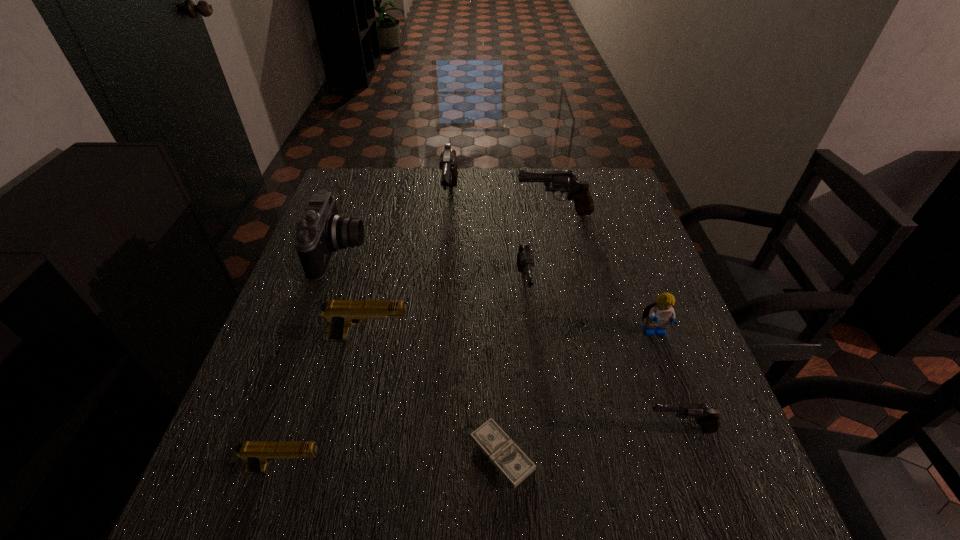
Locate an element on the screen. the smallest gray pistol is located at coordinates (708, 417).

Image resolution: width=960 pixels, height=540 pixels. I want to click on the smaller tan pistol, so click(256, 454).

I want to click on the nearest pistol, so click(x=256, y=454).

Locate an element on the screen. Image resolution: width=960 pixels, height=540 pixels. money is located at coordinates (506, 456).

You are a GUI agent. You are given a task and a screenshot of the screen. Output one action in this format:
    pyautogui.click(x=<x>, y=<y>)
    Task: Click on the vacant region located at the barrel of the leftmost gray pistol
    
    Given the screenshot: What is the action you would take?
    pos(438,337)

Where is `vacant space located 0.400m on the front-facing side of the black camera`? The height and width of the screenshot is (540, 960). vacant space located 0.400m on the front-facing side of the black camera is located at coordinates (516, 252).

At what (x,y) coordinates should I click in order to perform the action: click on vacant space located at the barrel of the fifth shortest pistol. Please return your answer as a coordinate pair (x, y). Image resolution: width=960 pixels, height=540 pixels. Looking at the image, I should click on (399, 213).

Image resolution: width=960 pixels, height=540 pixels. What are the coordinates of `free spot located 0.060m at the barrel of the fifth shortest pistol` in the screenshot? It's located at (495, 213).

I want to click on free space located at the barrel of the fifth shortest pistol, so click(x=410, y=213).

Find the location of a particular element. free location located at the barrel of the second smallest gray pistol is located at coordinates (542, 463).